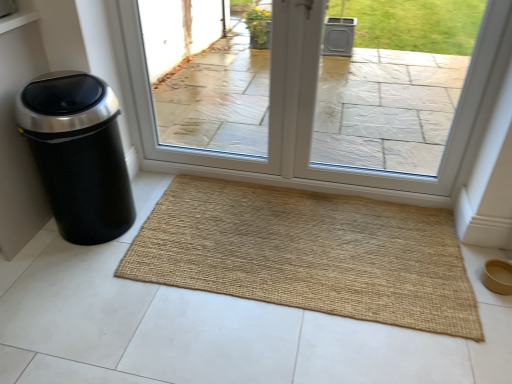
Question: From the image's perspective, is clear glass door at center located beneath black matte trash can at left?

Choices:
 (A) no
 (B) yes

Answer: (A)

Question: Considering the relative sizes of clear glass door at center and black matte trash can at left in the image provided, is clear glass door at center wider than black matte trash can at left?

Choices:
 (A) no
 (B) yes

Answer: (A)

Question: Does clear glass door at center have a lesser width compared to black matte trash can at left?

Choices:
 (A) yes
 (B) no

Answer: (A)

Question: Is clear glass door at center smaller than black matte trash can at left?

Choices:
 (A) yes
 (B) no

Answer: (B)

Question: Is clear glass door at center facing away from black matte trash can at left?

Choices:
 (A) yes
 (B) no

Answer: (B)

Question: Considering their positions, is black matte trash can at left located in front of or behind clear glass door at center?

Choices:
 (A) front
 (B) behind

Answer: (A)

Question: Is black matte trash can at left situated inside clear glass door at center or outside?

Choices:
 (A) inside
 (B) outside

Answer: (B)

Question: In terms of height, does black matte trash can at left look taller or shorter compared to clear glass door at center?

Choices:
 (A) short
 (B) tall

Answer: (A)

Question: From a real-world perspective, is black matte trash can at left physically located above or below clear glass door at center?

Choices:
 (A) below
 (B) above

Answer: (A)

Question: Considering the positions of natural fiber mat at center and black matte trash can at left in the image, is natural fiber mat at center taller or shorter than black matte trash can at left?

Choices:
 (A) tall
 (B) short

Answer: (B)

Question: In the image, is natural fiber mat at center positioned in front of or behind black matte trash can at left?

Choices:
 (A) front
 (B) behind

Answer: (B)

Question: Based on their positions, is natural fiber mat at center located to the left or right of black matte trash can at left?

Choices:
 (A) left
 (B) right

Answer: (B)

Question: From the image's perspective, is natural fiber mat at center above or below black matte trash can at left?

Choices:
 (A) below
 (B) above

Answer: (A)

Question: Is point (332, 183) closer or farther from the camera than point (375, 205)?

Choices:
 (A) closer
 (B) farther

Answer: (B)

Question: Based on their sizes in the image, would you say clear glass door at center is bigger or smaller than natural fiber mat at center?

Choices:
 (A) big
 (B) small

Answer: (A)